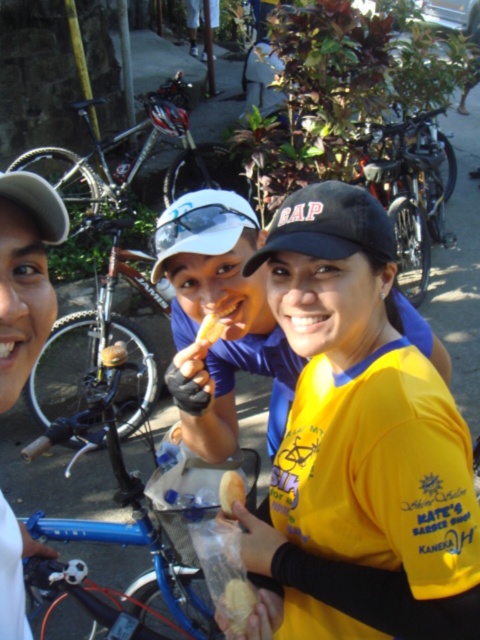
Question: Based on their relative distances, which object is farther from the yellow fabric shirt at center?

Choices:
 (A) blue metallic bicycle at center
 (B) silver metallic bicycle at upper left
 (C) brushed metal bicycle at left

Answer: (B)

Question: Does white matte cap at upper left appear on the right side of yellow matte bread at center?

Choices:
 (A) no
 (B) yes

Answer: (A)

Question: Is yellow fabric shirt at center positioned behind golden brown crumbly pastry at center?

Choices:
 (A) yes
 (B) no

Answer: (B)

Question: Which point is farther from the camera taking this photo?

Choices:
 (A) (276, 572)
 (B) (211, 339)
 (C) (124, 269)
 (D) (245, 589)

Answer: (C)

Question: Which point is farther to the camera?

Choices:
 (A) [x=227, y=472]
 (B) [x=416, y=451]
 (C) [x=24, y=269]
 (D) [x=109, y=614]

Answer: (D)

Question: Is yellow fabric shirt at center in front of white matte cap at upper left?

Choices:
 (A) no
 (B) yes

Answer: (A)